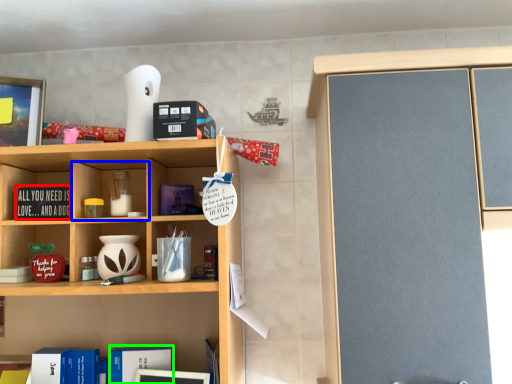
Question: Considering the real-world distances, which object is closest to book (highlighted by a red box)? cabinet (highlighted by a blue box) or book (highlighted by a green box).

Choices:
 (A) cabinet
 (B) book

Answer: (A)